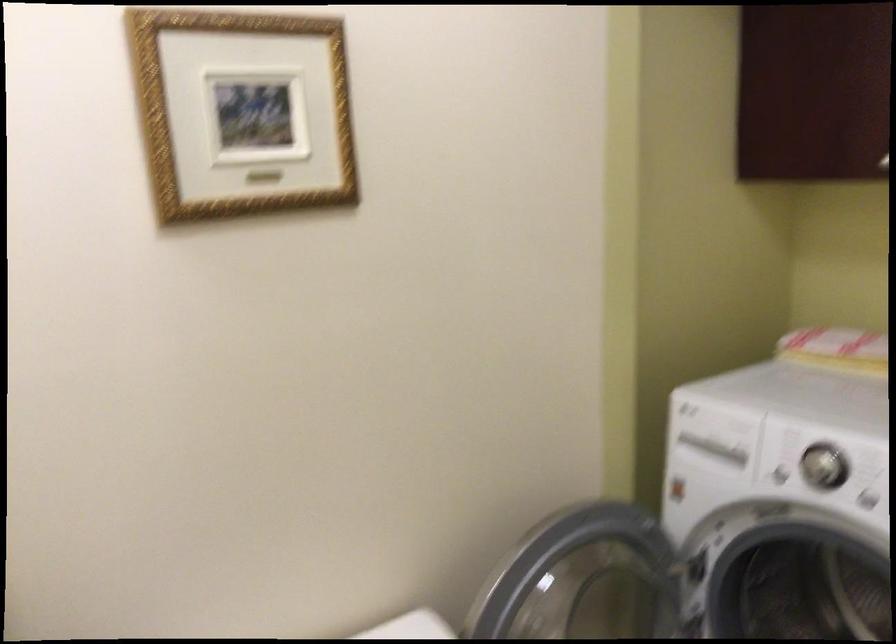
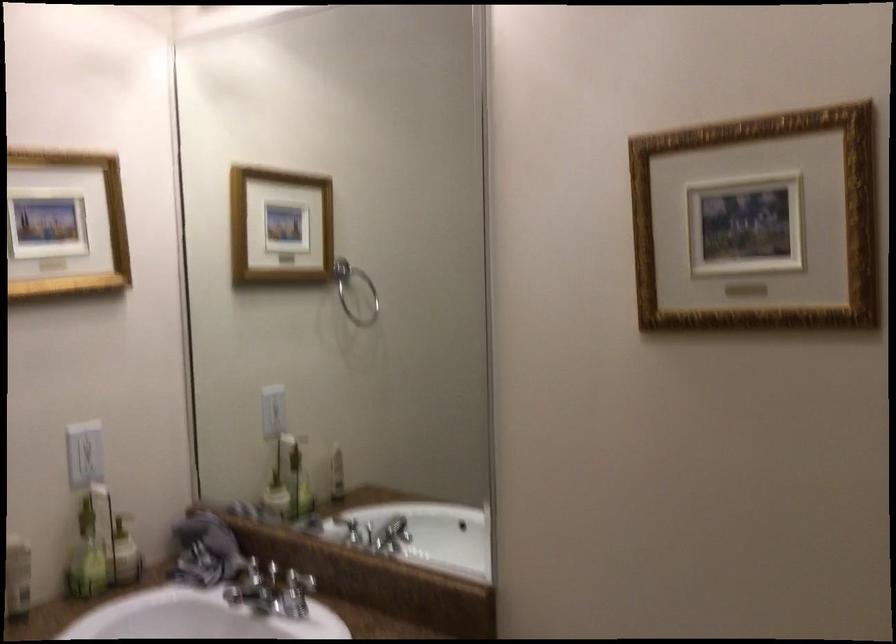
Question: The camera is either moving clockwise (left) or counter-clockwise (right) around the object. The first image is from the beginning of the video and the second image is from the end. Is the camera moving left or right when shooting the video?

Choices:
 (A) Left
 (B) Right

Answer: (B)